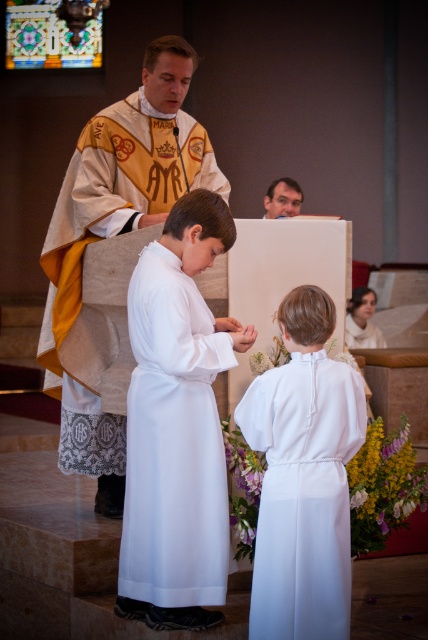
Between point (279, 428) and point (291, 193), which one is positioned in front?

Positioned in front is point (279, 428).

The height and width of the screenshot is (640, 428). What do you see at coordinates (303, 493) in the screenshot?
I see `white satin robe at lower center` at bounding box center [303, 493].

The width and height of the screenshot is (428, 640). Identify the location of white satin robe at lower center. (303, 493).

Is point (193, 164) positioned after point (270, 212)?

No, it is in front of (270, 212).

In the scene shown: Is gold embroidered robe at center behind smooth skin face at upper center?

That is False.

Which is in front, point (214, 186) or point (270, 184)?

Positioned in front is point (214, 186).

Identify the location of gold embroidered robe at center. (115, 234).

Is white satin robe at center smaller than white satin robe at lower center?

Actually, white satin robe at center might be larger than white satin robe at lower center.

Is white satin robe at center bigger than white satin robe at lower center?

Yes.

Is point (199, 316) less distant than point (312, 429)?

That is False.

This screenshot has height=640, width=428. Find the location of `white satin robe at center`. white satin robe at center is located at coordinates (174, 442).